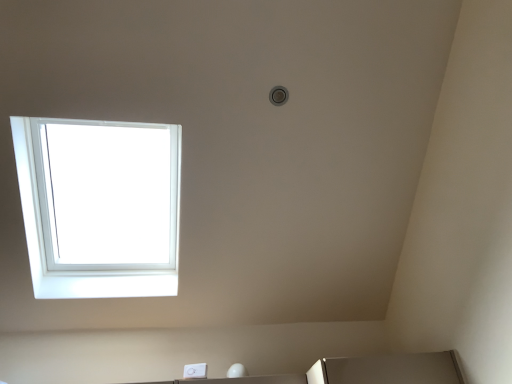
Image resolution: width=512 pixels, height=384 pixels. What do you see at coordinates (99, 206) in the screenshot?
I see `white plastic window at upper left` at bounding box center [99, 206].

In order to face white plastic window at upper left, should I rotate leftwards or rightwards?

It's best to rotate left around 19.453 degrees.

Locate an element on the screen. white plastic window at upper left is located at coordinates (99, 206).

This screenshot has height=384, width=512. What are the coordinates of `white plastic window at upper left` in the screenshot? It's located at (99, 206).